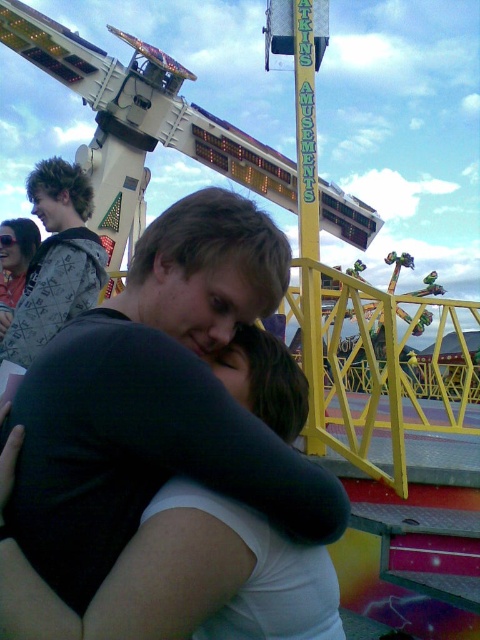
Describe the element at coordinates (204, 268) in the screenshot. I see `black matte shirt at center` at that location.

Does black matte shirt at center have a smaller size compared to sweater at upper left?

No, black matte shirt at center is not smaller than sweater at upper left.

Which is in front, point (171, 620) or point (40, 166)?

Point (171, 620) is more forward.

Where is `black matte shirt at center`? This screenshot has height=640, width=480. black matte shirt at center is located at coordinates (204, 268).